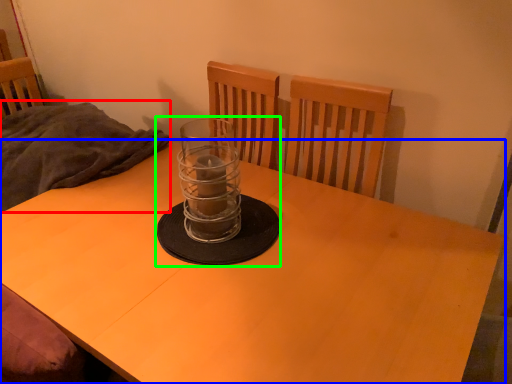
Question: Which object is the farthest from blanket (highlighted by a red box)? Choose among these: desk (highlighted by a blue box) or candle holder (highlighted by a green box).

Choices:
 (A) desk
 (B) candle holder

Answer: (B)